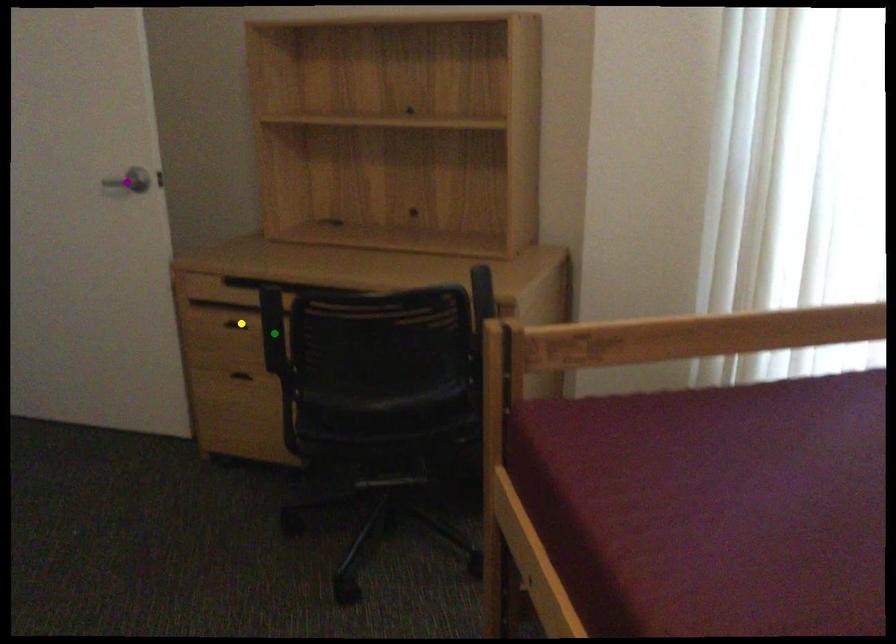
In the scene shown: Order these from nearest to farthest:
1. purple point
2. yellow point
3. green point

green point, yellow point, purple point